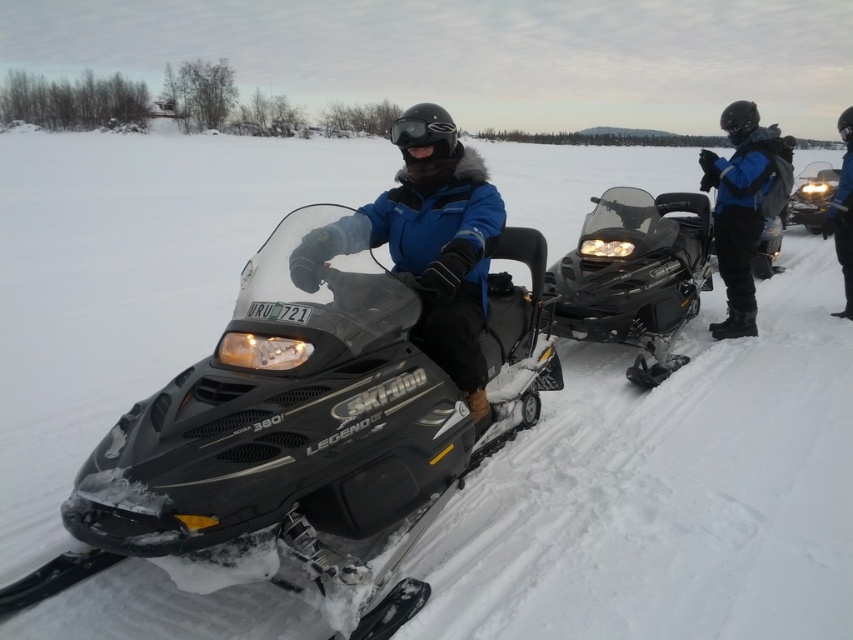
You are planning to take a photo of the snowmobiles from above. Which snowmobile would appear lower in the photo, the matte black snowmobile at center or the black matte snowmobile at right?

The matte black snowmobile at center appears lower in the photo because it is positioned below the black matte snowmobile at right according to the description.

You are planning to transport both snowmobiles on a trailer that can only carry items up to 2 meters in width. Given that the black plastic snowmobile at right is wider than the black matte snowmobile at right, which one would you choose to ensure it fits within the trailer width limit?

The black matte snowmobile at right is thinner than the black plastic snowmobile at right, so the black matte snowmobile at right would fit within the trailer width limit of 2 meters.